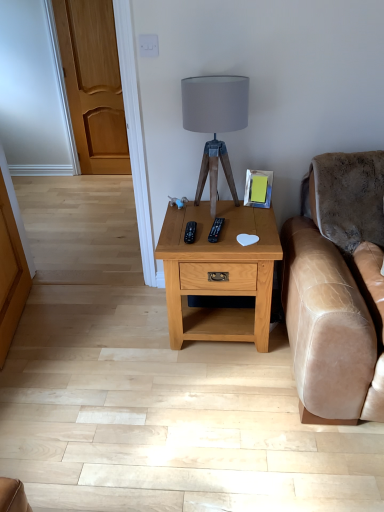
Image resolution: width=384 pixels, height=512 pixels. Identify the location of free space to the left of black plastic remote at center, the 1th remote in the right-to-left sequence. pyautogui.click(x=187, y=232).